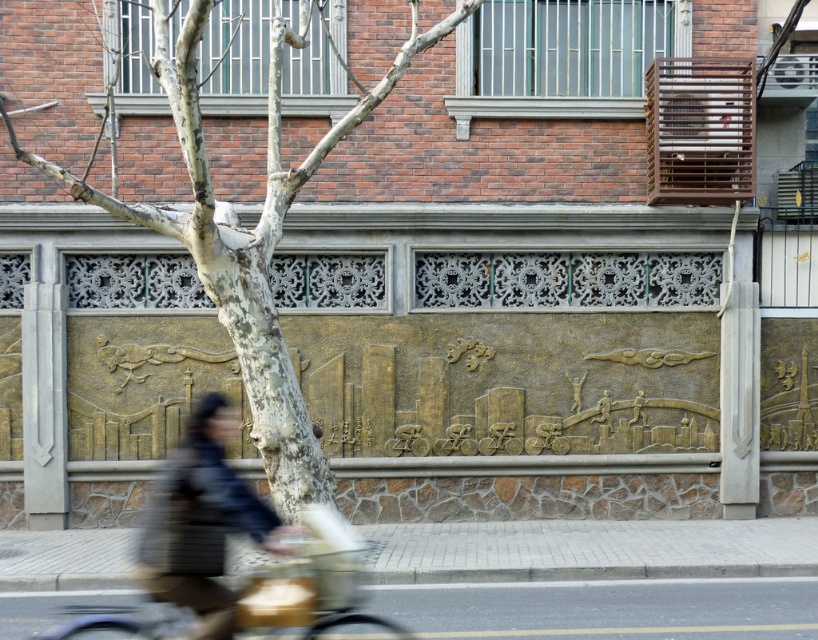
You are an artist standing in front of the building facade. You see a smooth bark tree at center and a matte black jacket at lower left. Which object is located to the right of the other?

The smooth bark tree at center is positioned on the right side of matte black jacket at lower left.

You are an architect examining the building facade. You notice a smooth bark tree at center in the mural. Can you determine its exact location on the mural using coordinates?

The smooth bark tree at center is located at coordinates point (246, 230).

You are a delivery person trying to place a small package on the wall near the matte black jacket at lower left and the gold metallic bicycle at lower left. Which object should you place the package closer to if you want it to be more visible?

The gold metallic bicycle at lower left is taller than the matte black jacket at lower left, so placing the package near the gold metallic bicycle at lower left would make it more visible.